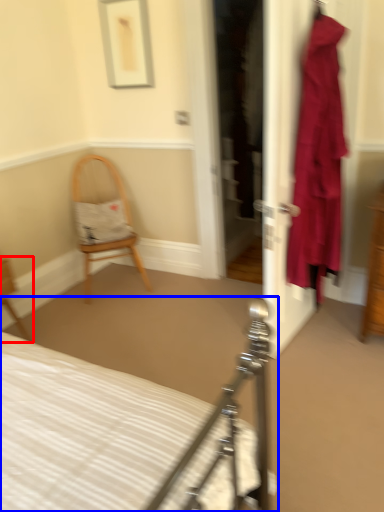
Question: Which object appears farthest to the camera in this image, chair (highlighted by a red box) or bed (highlighted by a blue box)?

Choices:
 (A) chair
 (B) bed

Answer: (A)